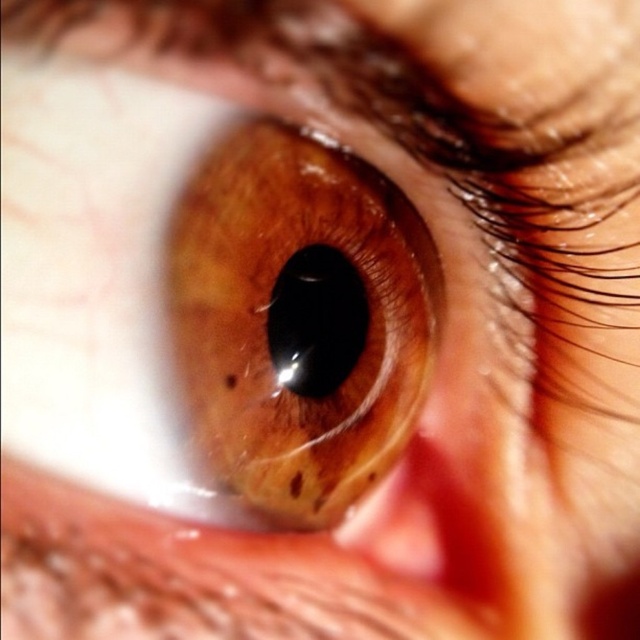
Does brown glossy eye at center appear on the right side of black glossy iris at center?

Correct, you'll find brown glossy eye at center to the right of black glossy iris at center.

Which is more to the left, brown glossy eye at center or black glossy iris at center?

black glossy iris at center is more to the left.

The height and width of the screenshot is (640, 640). What do you see at coordinates (300, 320) in the screenshot? I see `brown glossy eye at center` at bounding box center [300, 320].

Where is `brown glossy eye at center`? brown glossy eye at center is located at coordinates click(300, 320).